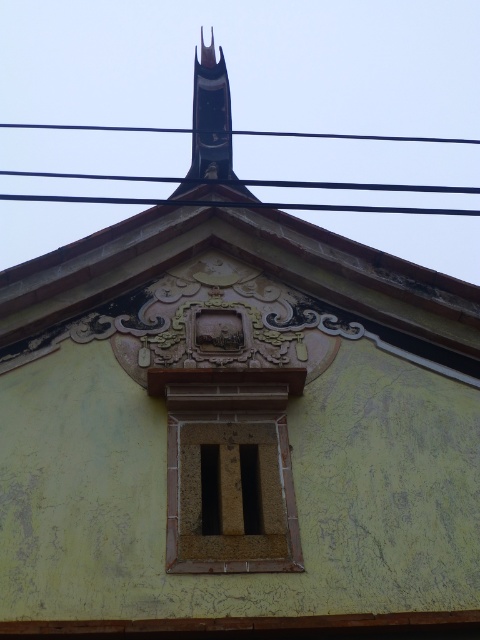
You are an architect reviewing the building facade. You need to install a new sensor on the facade such that it is placed above the brown textured stone window at center but below the black wire at upper center. Is there enough space between them to place the sensor?

The brown textured stone window at center is below the black wire at upper center, so there is space between them where the sensor can be placed.

You are standing in front of the building and want to determine the relative positions of two points marked on its facade. The points are labeled as point (237,540) and point (358,182). Which point is nearer to your current position?

Point (237,540) is closer to the viewer than point (358,182).

You are an architect examining the building facade. You notice the brown textured stone window at center and the black wire at upper center. Which object takes up more space on the facade?

The black wire at upper center takes up more space on the facade since the brown textured stone window at center has a smaller size compared to it.